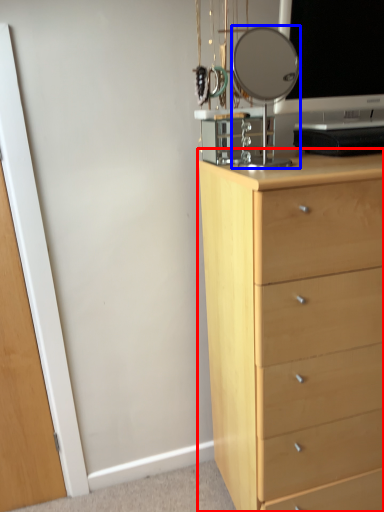
Question: Which point is closer to the camera, chest of drawers (highlighted by a red box) or mirror (highlighted by a blue box)?

Choices:
 (A) chest of drawers
 (B) mirror

Answer: (A)